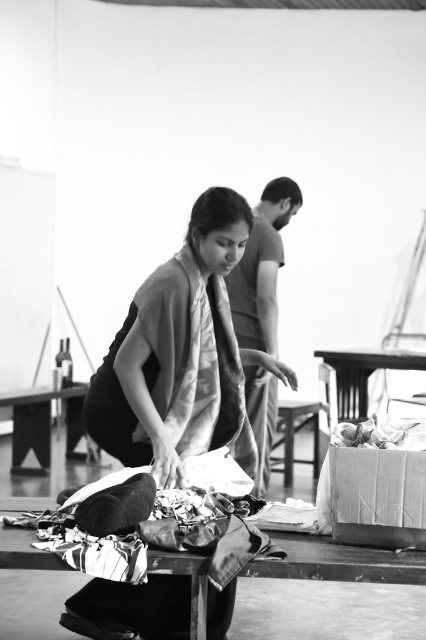
Question: Considering the real-world distances, which object is closest to the cardboard box at lower right?

Choices:
 (A) smooth wooden table at lower left
 (B) wooden table at center
 (C) silky black dress at center
 (D) metallic reflective table at lower center

Answer: (D)

Question: Estimate the real-world distances between objects in this image. Which object is closer to the smooth wooden table at lower left?

Choices:
 (A) crinkled paper bag at lower right
 (B) smooth gray shirt at upper center
 (C) silky black dress at center

Answer: (B)

Question: Which of the following is the closest to the observer?

Choices:
 (A) smooth wooden table at lower left
 (B) metallic reflective table at lower center
 (C) cardboard box at lower right

Answer: (B)

Question: Does silky black dress at center appear on the left side of crinkled paper bag at lower right?

Choices:
 (A) yes
 (B) no

Answer: (A)

Question: Is metallic reflective table at lower center to the right of wooden table at center from the viewer's perspective?

Choices:
 (A) yes
 (B) no

Answer: (B)

Question: Does metallic reflective table at lower center appear on the right side of smooth wooden table at lower left?

Choices:
 (A) no
 (B) yes

Answer: (B)